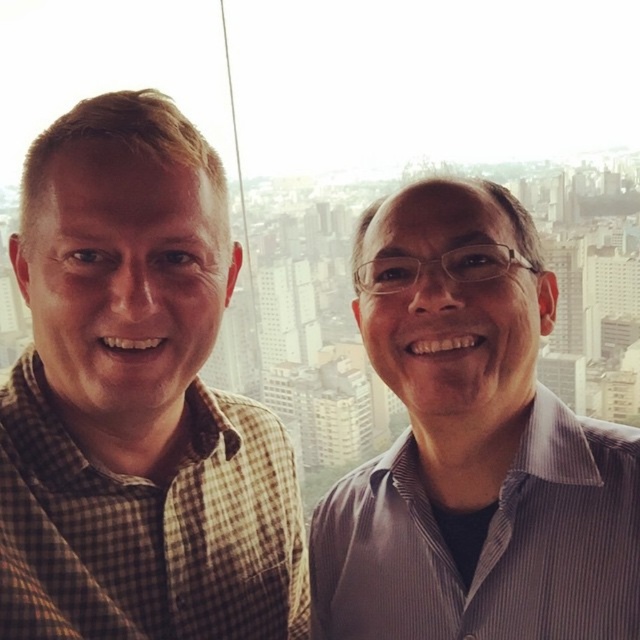
You are a photographer adjusting the camera focus. You need to focus on the person wearing the brown checkered shirt at left and the striped shirt at center. Which one should you focus on first to ensure both are in focus?

You should focus on the brown checkered shirt at left first because it is closer to the camera than the striped shirt at center, ensuring both will be in focus when focusing on the closer object first.

You are a photographer trying to capture a candid shot of the two people in the image. The camera you are using has a limited field of view. You need to adjust your position so that the point at coordinates [136,401], which is on the brown checkered shirt at left, remains visible while ensuring the glasses on the person on the right are also in frame. Is this possible given the current setup?

Yes, because the point at coordinates [136,401] on the brown checkered shirt at left and the glasses on the person on the right are both within the same field of view as they are positioned close together in the image.

You are a photographer who wants to ensure both subjects are centered in the frame. Given their current positions, which direction should the person in the striped shirt at center move to align with the person in the brown checkered shirt at left?

The striped shirt at center should move to the left to align with the brown checkered shirt at left since the brown checkered shirt at left is positioned on the left side of the striped shirt at center.